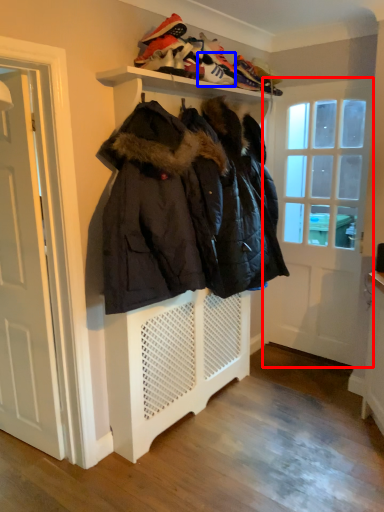
Question: Which point is closer to the camera, door (highlighted by a red box) or shoe (highlighted by a blue box)?

Choices:
 (A) door
 (B) shoe

Answer: (B)